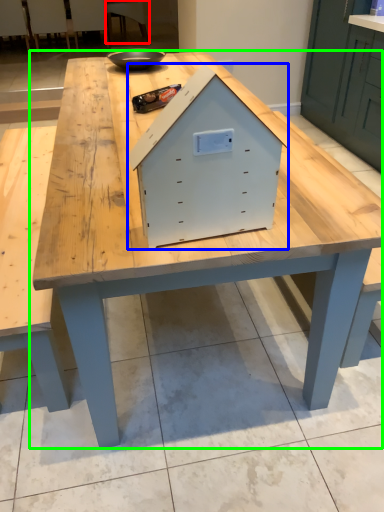
Question: Estimate the real-world distances between objects in this image. Which object is closer to chair (highlighted by a red box), crate (highlighted by a blue box) or table (highlighted by a green box)?

Choices:
 (A) crate
 (B) table

Answer: (B)